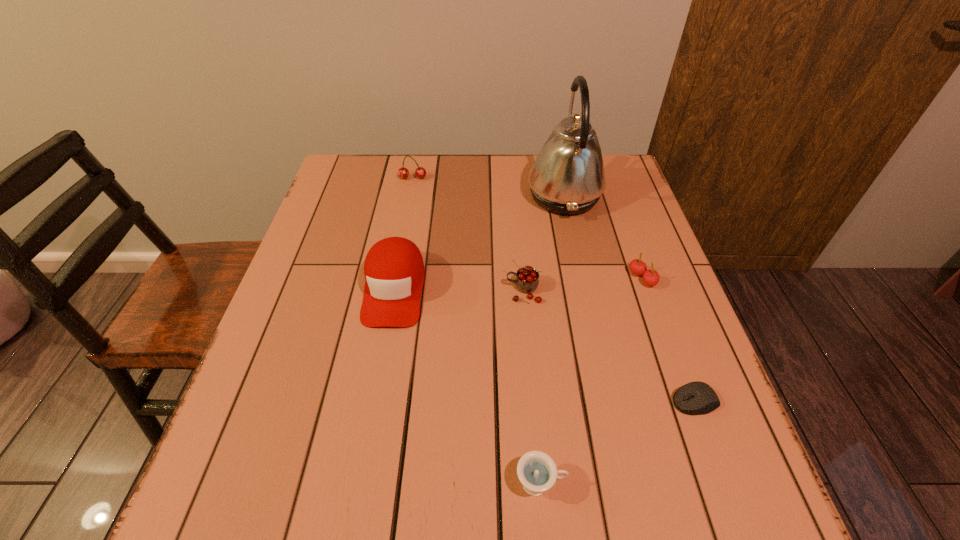
Locate an element on the screen. vacant space located from the spout of the kettle is located at coordinates (430, 196).

Where is `free location located 0.070m on the front-facing side of the sixth shortest object`? free location located 0.070m on the front-facing side of the sixth shortest object is located at coordinates pyautogui.click(x=382, y=357).

The image size is (960, 540). What are the coordinates of `blank space located 0.180m with stems pointing upwards on the farthest cherry` in the screenshot? It's located at (405, 219).

Locate an element on the screen. The width and height of the screenshot is (960, 540). vacant space positioned 0.400m on the handle side of the second cherry from left to right is located at coordinates (333, 291).

At what (x,y) coordinates should I click in order to perform the action: click on free point located on the handle side of the second cherry from left to right. Please return your answer as a coordinate pair (x, y). Image resolution: width=960 pixels, height=540 pixels. Looking at the image, I should click on (346, 291).

The width and height of the screenshot is (960, 540). In order to click on vacant space located 0.200m on the handle side of the second cherry from left to right in this screenshot , I will do `click(420, 291)`.

Where is `free location located 0.340m on the front of the rightmost cherry`? This screenshot has height=540, width=960. free location located 0.340m on the front of the rightmost cherry is located at coordinates (696, 432).

This screenshot has width=960, height=540. In order to click on vacant area situated 0.120m on the side of the nearest object with the handle in this screenshot , I will do `click(638, 484)`.

At what (x,y) coordinates should I click in order to perform the action: click on vacant area situated on the back of the shortest object. Please return your answer as a coordinate pair (x, y). Looking at the image, I should click on (664, 318).

At what (x,y) coordinates should I click in order to perform the action: click on kettle at the far edge. Please return your answer as a coordinate pair (x, y). Looking at the image, I should click on (567, 177).